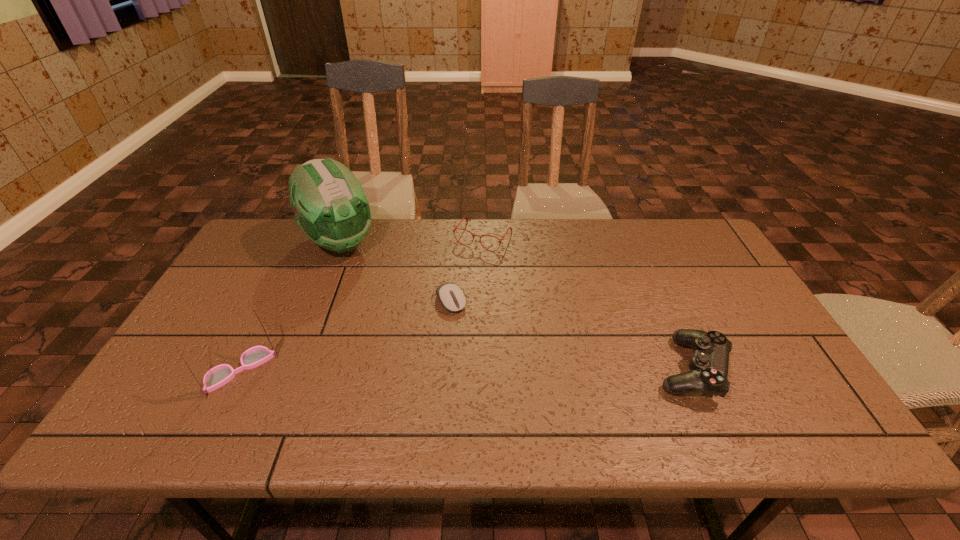
Locate an element on the screen. The height and width of the screenshot is (540, 960). the nearer spectacles is located at coordinates (218, 376).

This screenshot has width=960, height=540. Identify the location of the fourth shortest object. (218, 376).

Image resolution: width=960 pixels, height=540 pixels. I want to click on the third tallest object, so click(708, 372).

I want to click on control, so click(708, 372).

Image resolution: width=960 pixels, height=540 pixels. I want to click on the third nearest object, so click(x=451, y=296).

You are a GUI agent. You are given a task and a screenshot of the screen. Output one action in this format:
    pyautogui.click(x=<x>, y=<y>)
    Task: Click on the computer equipment
    The height and width of the screenshot is (540, 960).
    Given the screenshot: What is the action you would take?
    pyautogui.click(x=451, y=296)

Where is `football helmet`? football helmet is located at coordinates (331, 207).

Find the location of a particular element. the farther spectacles is located at coordinates (455, 228).

Locate an element on the screen. Image resolution: width=960 pixels, height=540 pixels. the shorter spectacles is located at coordinates (455, 228).

The width and height of the screenshot is (960, 540). I want to click on vacant space positioned 0.200m on the back of the taller spectacles, so click(x=279, y=291).